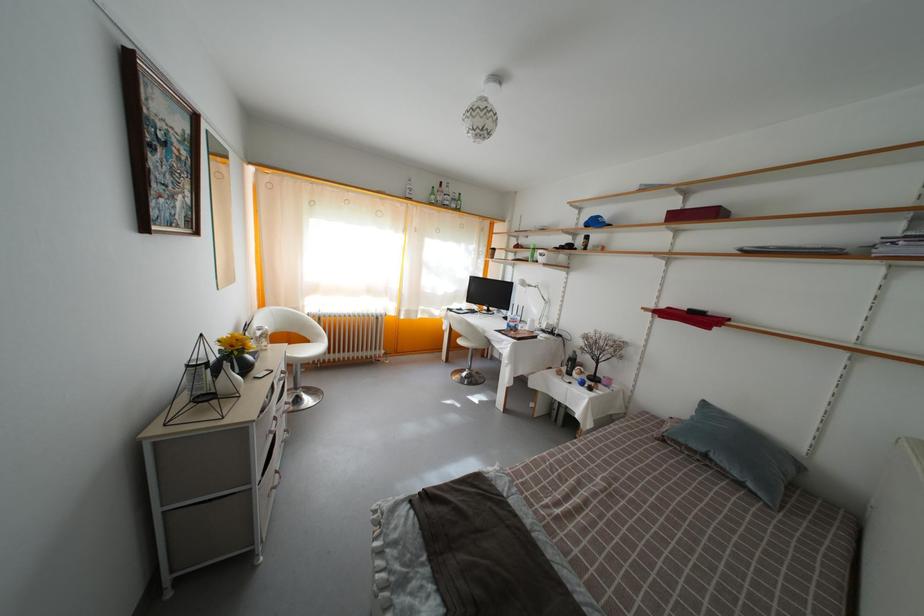
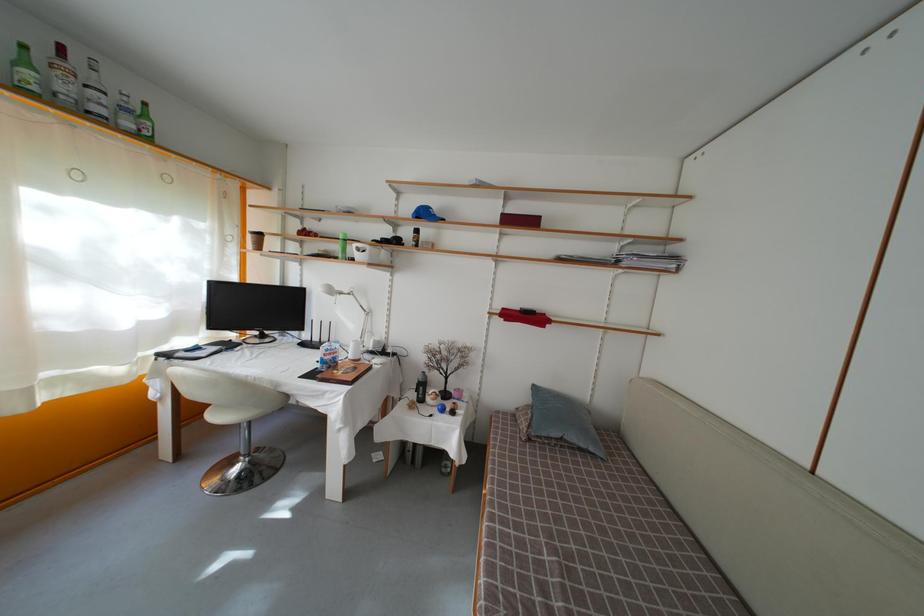
Question: The camera is either moving clockwise (left) or counter-clockwise (right) around the object. The first image is from the beginning of the video and the second image is from the end. Is the camera moving left or right when shooting the video?

Choices:
 (A) Left
 (B) Right

Answer: (A)